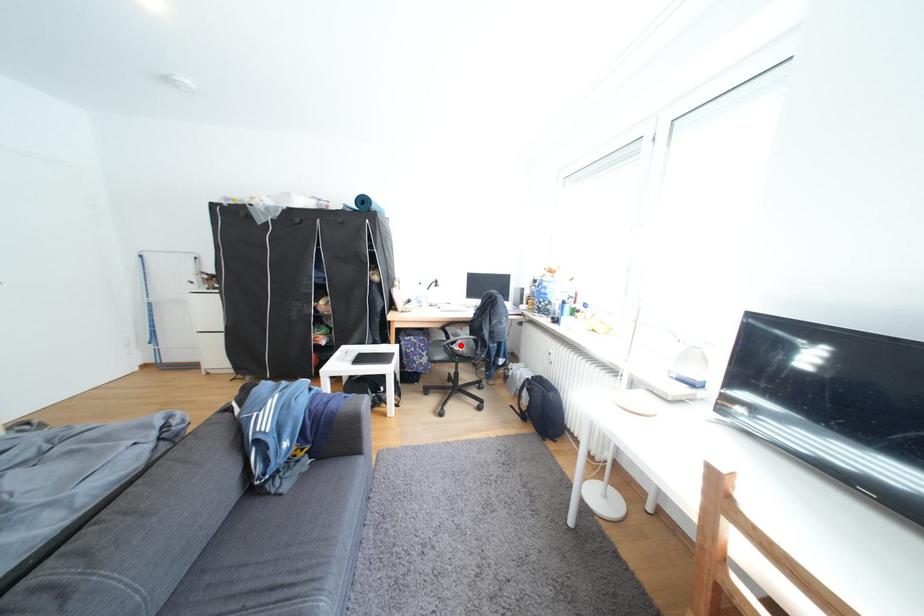
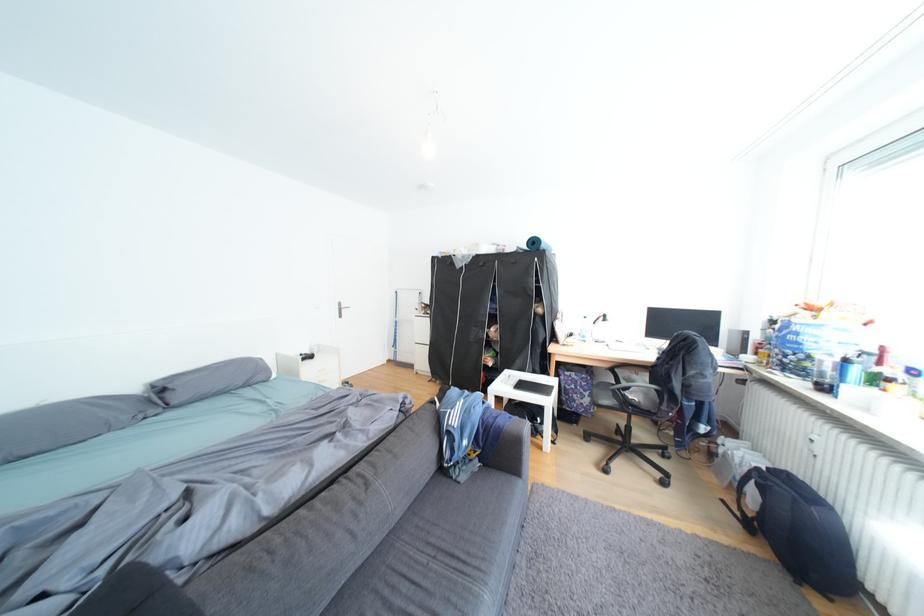
Find the pixel in the second image that matches the highlighted location in the first image.

(631, 390)